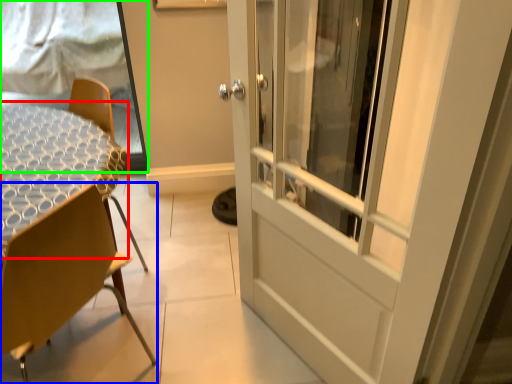
Question: Estimate the real-world distances between objects in this image. Which object is closer to round table (highlighted by a red box), chair (highlighted by a blue box) or window screen (highlighted by a green box)?

Choices:
 (A) chair
 (B) window screen

Answer: (A)